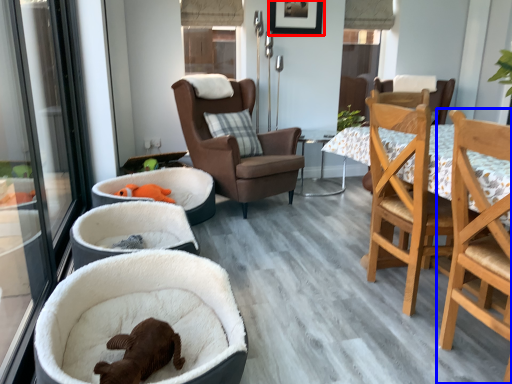
Question: Which point is closer to the camera, picture frame (highlighted by a red box) or chair (highlighted by a blue box)?

Choices:
 (A) picture frame
 (B) chair

Answer: (B)